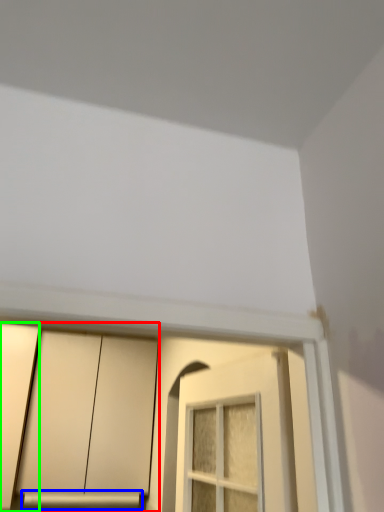
Question: Which is farther away from cabinetry (highlighted by a red box)? window sill (highlighted by a blue box) or door (highlighted by a green box)?

Choices:
 (A) window sill
 (B) door

Answer: (A)